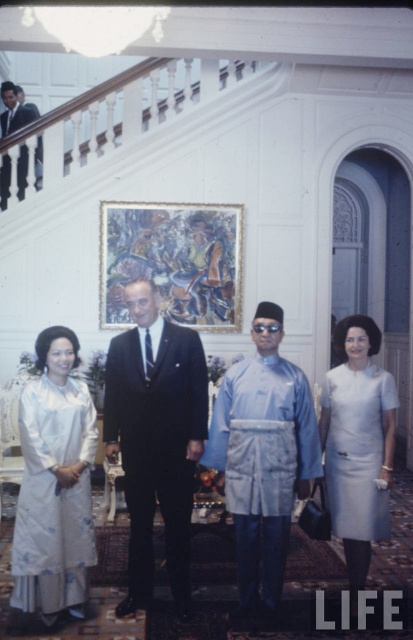
You are a photographer at the event and need to capture a group photo of the dark suit at center and the silky white dress at lower left. The camera you are using has a minimum focus distance of 12 inches. Will you be able to get a clear photo of both subjects without moving the camera?

The distance between the dark suit at center and the silky white dress at lower left is 12.46 inches, which is just over the camera minimum focus distance of 12 inches. Therefore, you can capture both subjects clearly without moving the camera.

You are standing at the entrance of the room and want to greet both the person in the dark suit at center and the person in the silky white dress at lower left. Which one should you approach first based on their positions?

You should approach the dark suit at center first because it is closer to you than the silky white dress at lower left, so you can greet them in order of proximity.

You are a photographer at this event and want to capture a photo of both the light blue silk robe at center and the silky white dress at lower left. Which robe is located to the right of the dress?

The light blue silk robe at center is positioned on the right side of the silky white dress at lower left, so it is to the right of the dress.